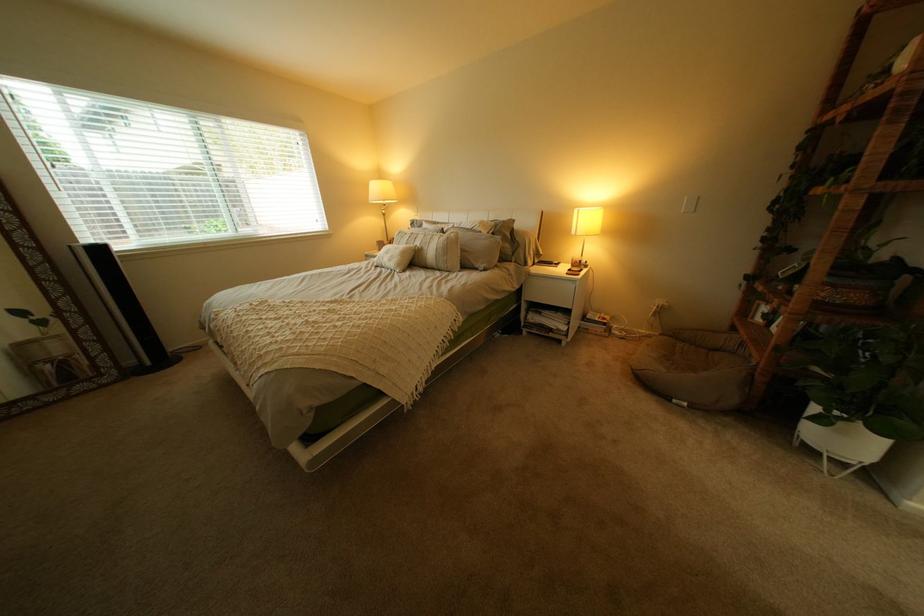
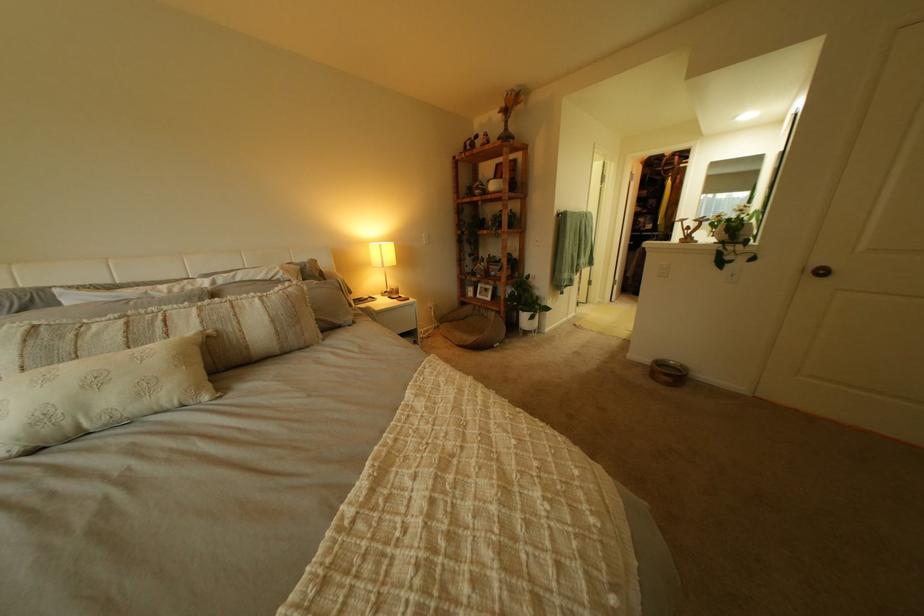
Locate, in the second image, the point that corresponds to pixel 588 209 in the first image.

(381, 244)